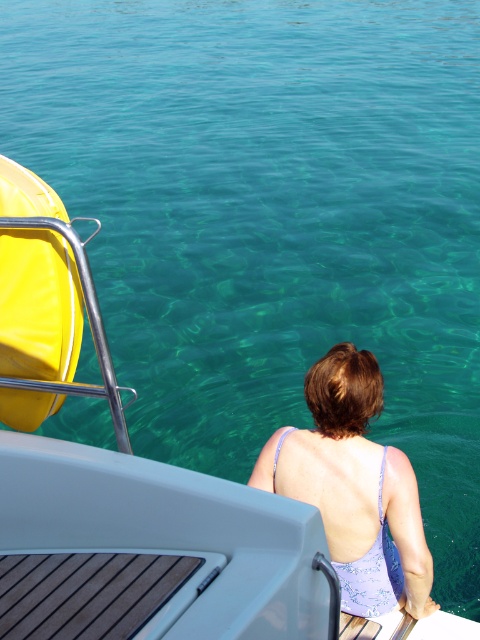
Question: Can you confirm if purple fabric swimsuit at center is positioned above matte yellow life jacket at left?

Choices:
 (A) yes
 (B) no

Answer: (B)

Question: In this image, where is purple fabric swimsuit at center located relative to matte yellow life jacket at left?

Choices:
 (A) right
 (B) left

Answer: (A)

Question: Where is purple fabric swimsuit at center located in relation to matte yellow life jacket at left in the image?

Choices:
 (A) above
 (B) below

Answer: (B)

Question: Which of the following is the farthest from the observer?

Choices:
 (A) matte yellow life jacket at left
 (B) purple fabric swimsuit at center

Answer: (B)

Question: Which of the following is the farthest from the observer?

Choices:
 (A) purple fabric swimsuit at center
 (B) matte yellow life jacket at left

Answer: (A)

Question: Which point is closer to the camera?

Choices:
 (A) matte yellow life jacket at left
 (B) purple fabric swimsuit at center

Answer: (A)